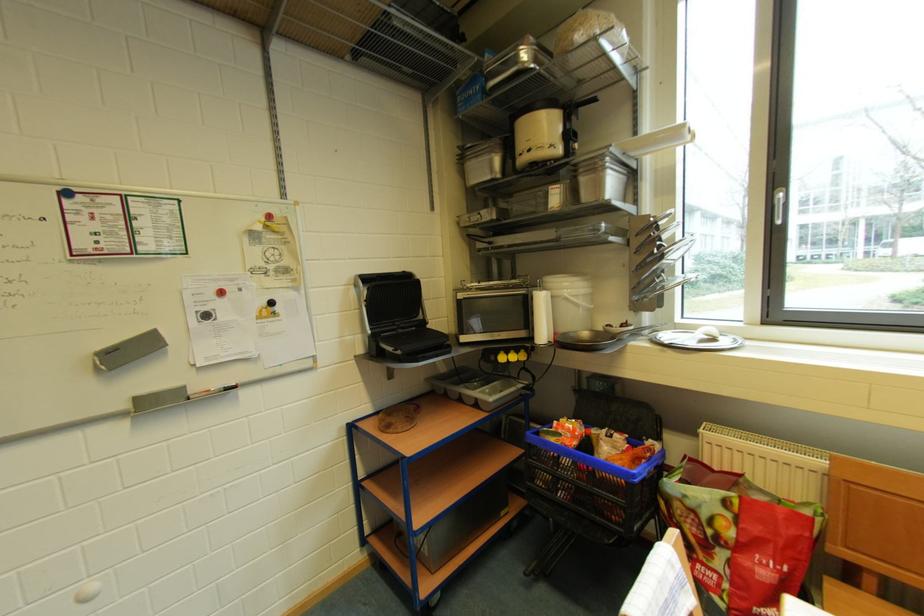
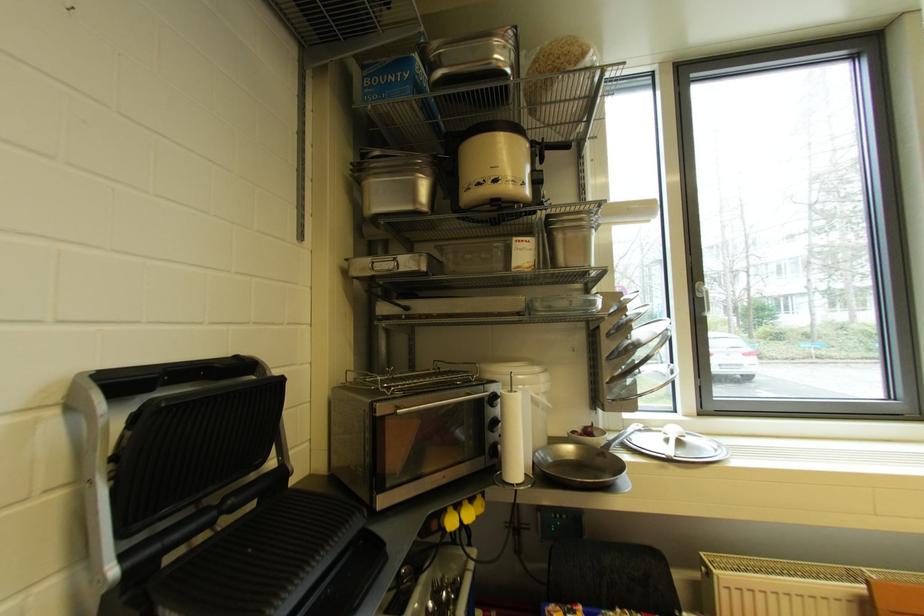
In the second image, find the point that corresponds to point 481,222 in the first image.

(392, 269)